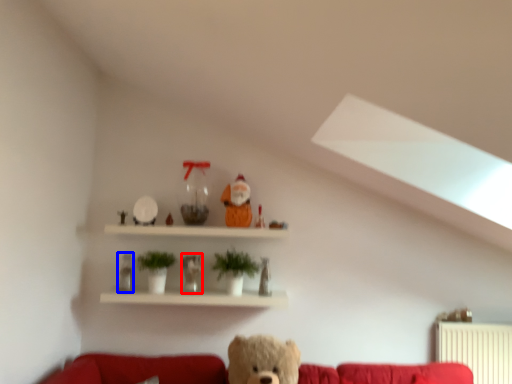
Question: Which object is further to the camera taking this photo, figurine (highlighted by a red box) or toy (highlighted by a blue box)?

Choices:
 (A) figurine
 (B) toy

Answer: (B)